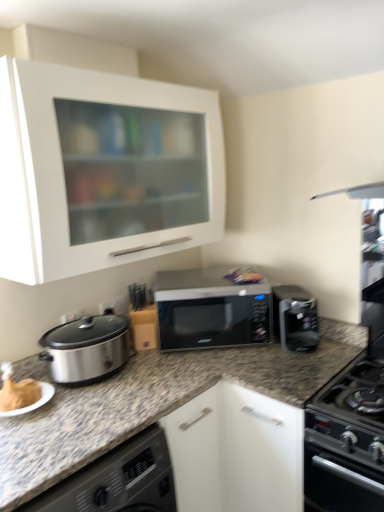
Question: Is sleek black microwave at center positioned before white matte cabinet at upper left?

Choices:
 (A) no
 (B) yes

Answer: (A)

Question: Considering the relative positions of sleek black microwave at center and white matte cabinet at upper left in the image provided, is sleek black microwave at center to the right of white matte cabinet at upper left from the viewer's perspective?

Choices:
 (A) no
 (B) yes

Answer: (B)

Question: Is sleek black microwave at center next to white matte cabinet at upper left?

Choices:
 (A) no
 (B) yes

Answer: (A)

Question: Can you confirm if sleek black microwave at center is shorter than white matte cabinet at upper left?

Choices:
 (A) yes
 (B) no

Answer: (A)

Question: Is sleek black microwave at center taller than white matte cabinet at upper left?

Choices:
 (A) yes
 (B) no

Answer: (B)

Question: Considering the relative positions of sleek black microwave at center and white matte cabinet at upper left in the image provided, is sleek black microwave at center to the left or to the right of white matte cabinet at upper left?

Choices:
 (A) left
 (B) right

Answer: (B)

Question: From a real-world perspective, is sleek black microwave at center above or below white matte cabinet at upper left?

Choices:
 (A) above
 (B) below

Answer: (B)

Question: In terms of height, does sleek black microwave at center look taller or shorter compared to white matte cabinet at upper left?

Choices:
 (A) tall
 (B) short

Answer: (B)

Question: From the image's perspective, is sleek black microwave at center above or below white matte cabinet at upper left?

Choices:
 (A) above
 (B) below

Answer: (B)

Question: From the image's perspective, is black matte oven at lower right located above or below multicolored plastic bag at center?

Choices:
 (A) below
 (B) above

Answer: (A)

Question: Considering the relative positions of black matte oven at lower right and multicolored plastic bag at center in the image provided, is black matte oven at lower right to the left or to the right of multicolored plastic bag at center?

Choices:
 (A) right
 (B) left

Answer: (A)

Question: Is black matte oven at lower right taller or shorter than multicolored plastic bag at center?

Choices:
 (A) tall
 (B) short

Answer: (A)

Question: Considering the positions of point click(379, 495) and point click(238, 266), is point click(379, 495) closer or farther from the camera than point click(238, 266)?

Choices:
 (A) closer
 (B) farther

Answer: (A)

Question: Choose the correct answer: Is multicolored plastic bag at center inside satin black coffee maker at right or outside it?

Choices:
 (A) inside
 (B) outside

Answer: (B)

Question: From a real-world perspective, is multicolored plastic bag at center physically located above or below satin black coffee maker at right?

Choices:
 (A) above
 (B) below

Answer: (A)